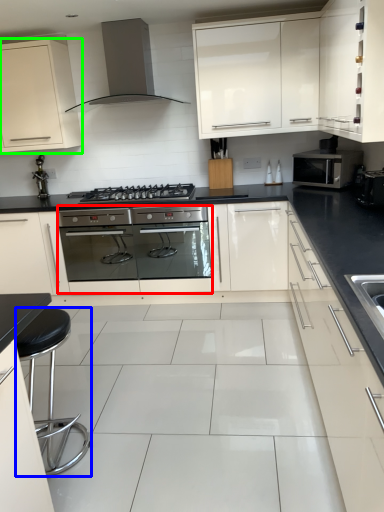
Question: Which is farther away from oven (highlighted by a red box)? bar stool (highlighted by a blue box) or cabinetry (highlighted by a green box)?

Choices:
 (A) bar stool
 (B) cabinetry

Answer: (A)